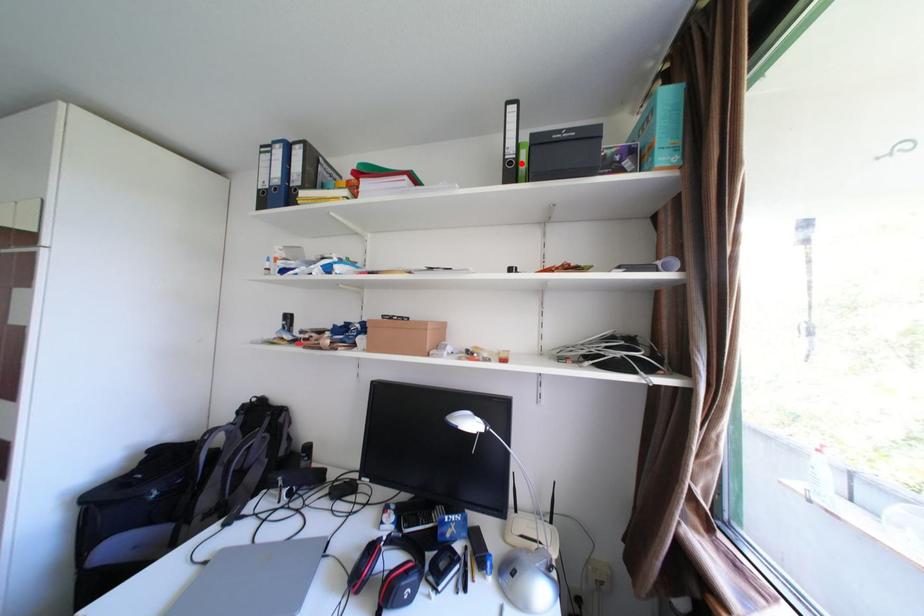
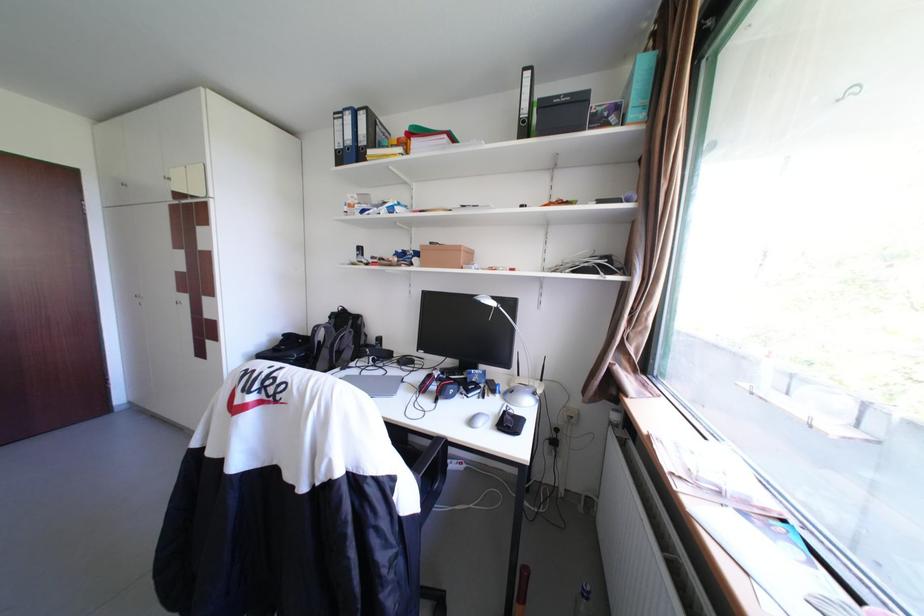
The point at the highlighted location is marked in the first image. Where is the corresponding point in the second image?

(535, 122)